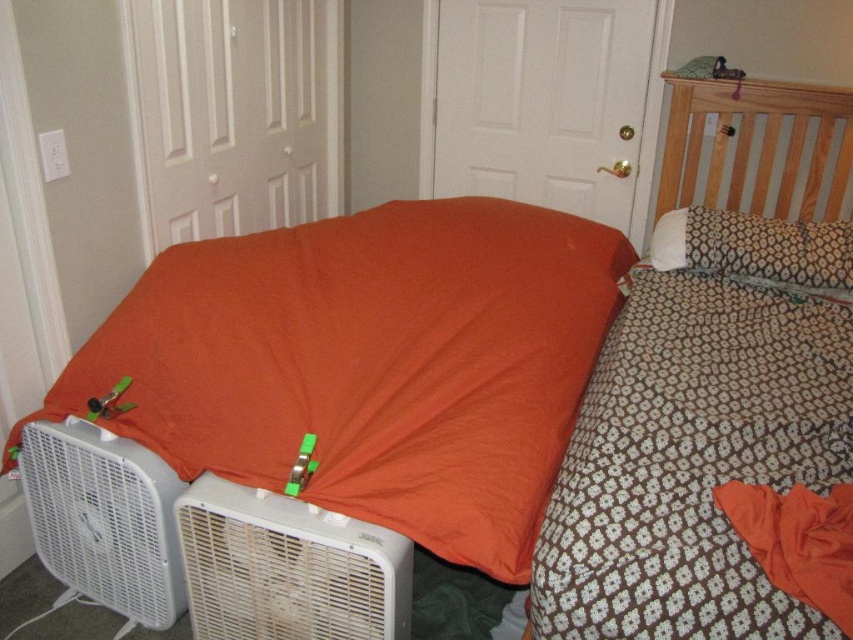
You are organizing a charity event and need to determine which item, the orange fabric at left or the white textured pillow at upper right, can be used to cover a large donation box. Based on their sizes, which one would be more suitable?

The orange fabric at left is larger in size than the white textured pillow at upper right, so it would be more suitable for covering the large donation box.

You are trying to decide which appliance to move first. The white plastic air conditioner at lower left and the white plastic fan at lower left are both in the same area. Which one is shorter and easier to move?

The white plastic air conditioner at lower left is not as tall as the white plastic fan at lower left, so it is shorter and easier to move.

You are trying to determine which object is wider between the orange fabric at left and the white plastic fan at lower left. Based on the scene, which one is wider?

The orange fabric at left is wider than the white plastic fan at lower left according to the description provided.